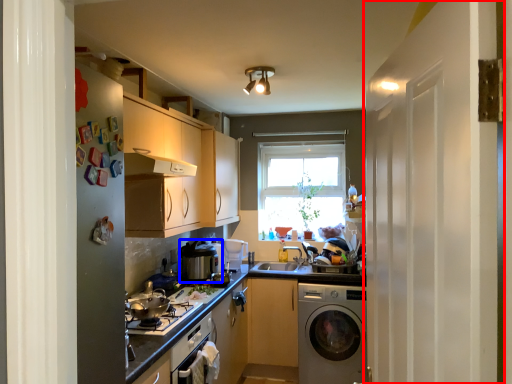
Question: Among these objects, which one is nearest to the camera, screen door (highlighted by a red box) or appliance (highlighted by a blue box)?

Choices:
 (A) screen door
 (B) appliance

Answer: (A)